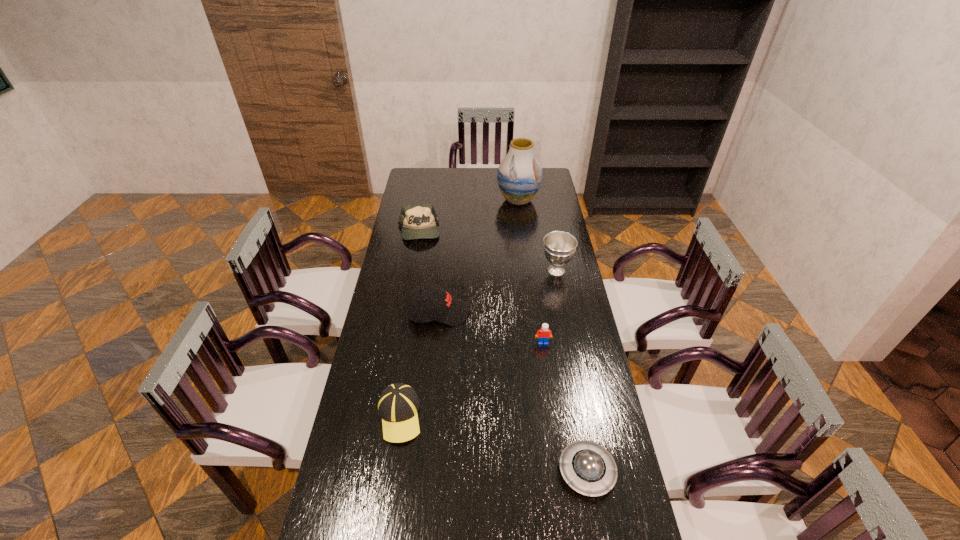
This screenshot has width=960, height=540. In order to click on vacant area that lies between the farthest object and the third nearest object in this screenshot , I will do `click(531, 271)`.

Where is `vacant space in between the second tallest object and the saucer`? The width and height of the screenshot is (960, 540). vacant space in between the second tallest object and the saucer is located at coordinates (571, 371).

The width and height of the screenshot is (960, 540). What are the coordinates of `object that stands as the fifth closest to the nearest baseball cap` in the screenshot? It's located at (417, 221).

Select which object appears as the closest to the shortest object. Please provide its 2D coordinates. Your answer should be formatted as a tuple, i.e. [(x, y)], where the tuple contains the x and y coordinates of a point satisfying the conditions above.

[(543, 335)]

Where is `the second closest baseball cap to the second nearest baseball cap`? This screenshot has height=540, width=960. the second closest baseball cap to the second nearest baseball cap is located at coordinates (417, 221).

Locate an element on the screen. the third closest baseball cap to the third farthest object is located at coordinates (398, 404).

This screenshot has height=540, width=960. Identify the location of vacant space that satisfies the following two spatial constraints: 1. on the front-facing side of the sixth shortest object; 2. on the left side of the second farthest object. (412, 271).

I want to click on vacant area that satisfies the following two spatial constraints: 1. with the brim of the saucer facing forward; 2. on the right side of the nearest baseball cap, so click(391, 471).

At what (x,y) coordinates should I click in order to perform the action: click on free location that satisfies the following two spatial constraints: 1. on the face of the third nearest object; 2. on the right side of the shortest object. Please return your answer as a coordinate pair (x, y). The height and width of the screenshot is (540, 960). Looking at the image, I should click on (561, 471).

This screenshot has width=960, height=540. I want to click on vacant region that satisfies the following two spatial constraints: 1. on the front side of the third farthest object; 2. on the front-facing side of the fourth farthest object, so click(564, 313).